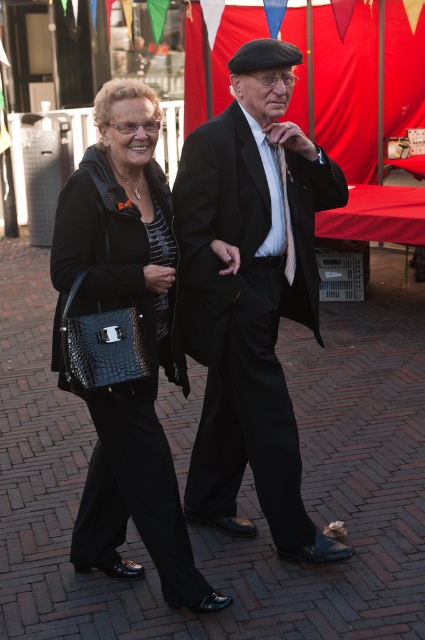
You are a tailor who needs to determine which item requires more fabric between the black matte suit at center and the striped silk tie at center. Which one would need more fabric?

The black matte suit at center requires more fabric than the striped silk tie at center because it is bigger.